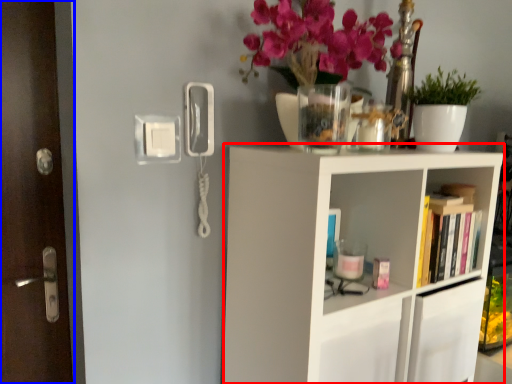
Question: Which object is closer to the camera taking this photo, shelf (highlighted by a red box) or door (highlighted by a blue box)?

Choices:
 (A) shelf
 (B) door

Answer: (A)